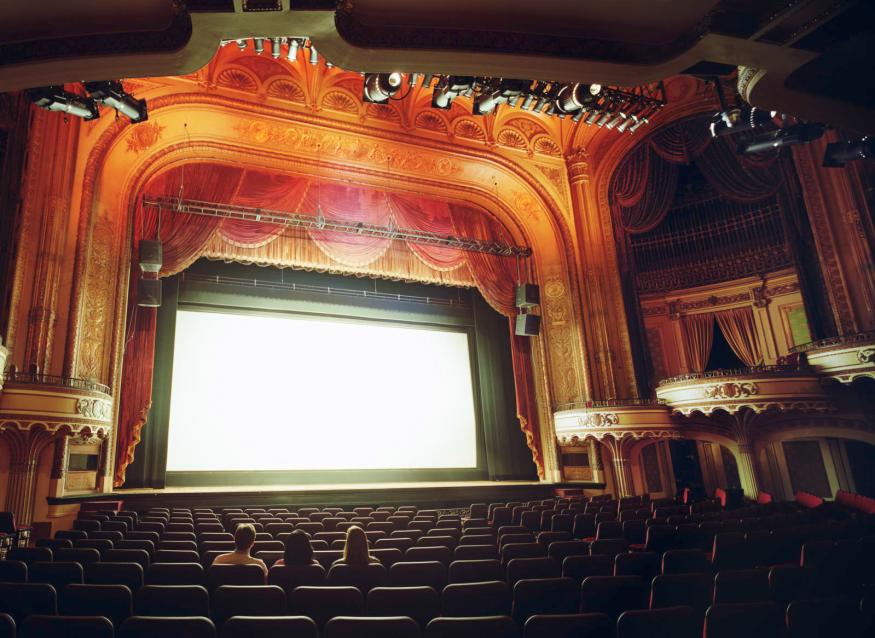
Where is `curtain`? The height and width of the screenshot is (638, 875). curtain is located at coordinates tap(744, 349), tap(693, 345).